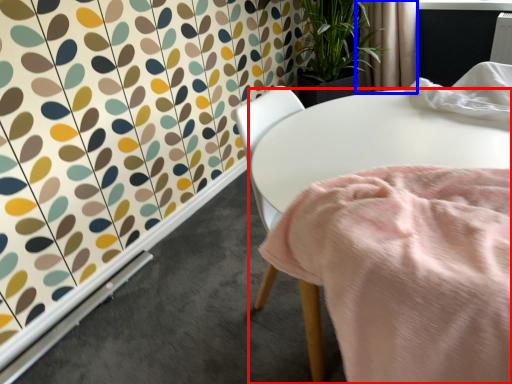
Question: Which object appears closest to the camera in this image, table (highlighted by a red box) or curtain (highlighted by a blue box)?

Choices:
 (A) table
 (B) curtain

Answer: (A)